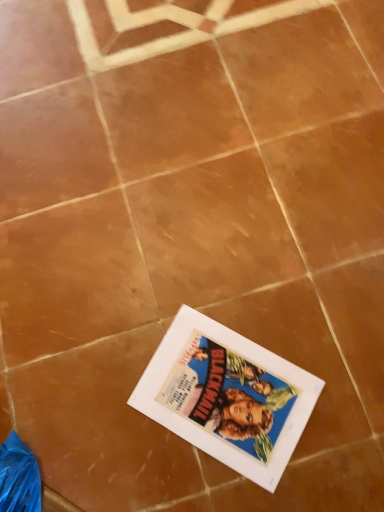
Where is `vacant space positioned to the left of matte paper book cover at center`? The image size is (384, 512). vacant space positioned to the left of matte paper book cover at center is located at coordinates (99, 413).